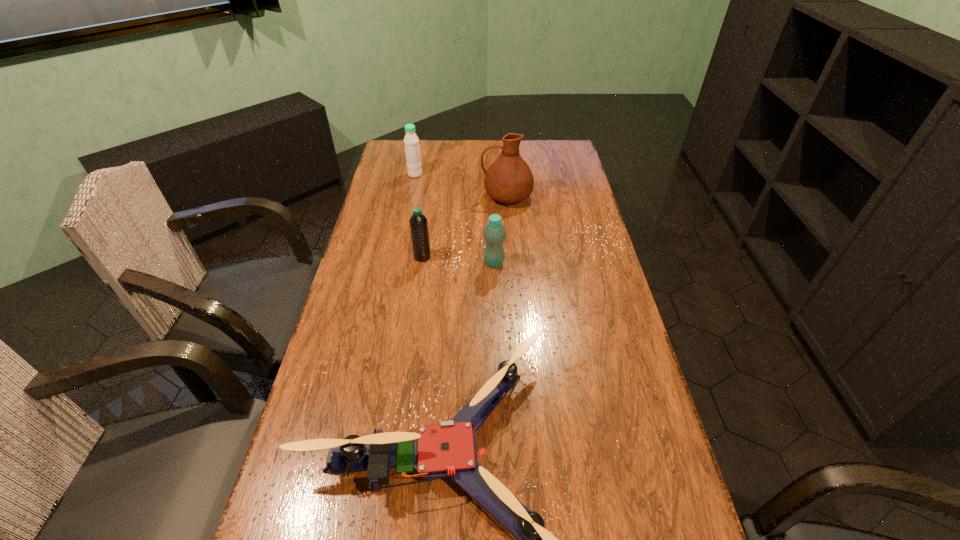
Find the location of a particular element. The width and height of the screenshot is (960, 540). free space located on the right of the second water bottle from left to right is located at coordinates (480, 257).

Find the location of a particular element. vacant area situated 0.360m at the front cap of the rightmost water bottle is located at coordinates (497, 366).

Identify the location of object that is at the left edge. This screenshot has width=960, height=540. (411, 142).

In the image, there is a desktop. Where is `free space at the far edge`? free space at the far edge is located at coordinates (463, 161).

You are a GUI agent. You are given a task and a screenshot of the screen. Output one action in this format:
    pyautogui.click(x=<x>, y=<y>)
    Task: Click on the vacant space at the left edge of the desktop
    The image size is (960, 540).
    Given the screenshot: What is the action you would take?
    pyautogui.click(x=333, y=359)

Image resolution: width=960 pixels, height=540 pixels. I want to click on blank area at the right edge, so click(x=585, y=264).

I want to click on free space at the far right corner, so click(549, 167).

Where is `free space between the farthest object and the tallest object`? free space between the farthest object and the tallest object is located at coordinates (461, 185).

At what (x,y) coordinates should I click in order to perform the action: click on vacant space in between the farthest object and the second farthest object. Please return your answer as a coordinate pair (x, y). Looking at the image, I should click on (461, 185).

Where is `vacant space that is in between the second water bottle from left to right and the pitcher`? vacant space that is in between the second water bottle from left to right and the pitcher is located at coordinates pos(465,227).